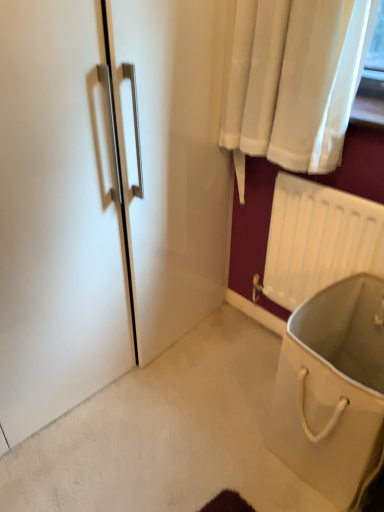
What do you see at coordinates (318, 239) in the screenshot?
I see `white matte radiator at lower right` at bounding box center [318, 239].

You are a GUI agent. You are given a task and a screenshot of the screen. Output one action in this format:
    pyautogui.click(x=<x>, y=<y>)
    Task: Click on the white matte radiator at lower right
    The width and height of the screenshot is (384, 512).
    Given the screenshot: What is the action you would take?
    pyautogui.click(x=318, y=239)

You are a GUI agent. You are given a task and a screenshot of the screen. Output one action in this format:
    pyautogui.click(x=<x>, y=<y>)
    Task: Click on the white matte radiator at lower right
    The height and width of the screenshot is (512, 384).
    Given the screenshot: What is the action you would take?
    pyautogui.click(x=318, y=239)